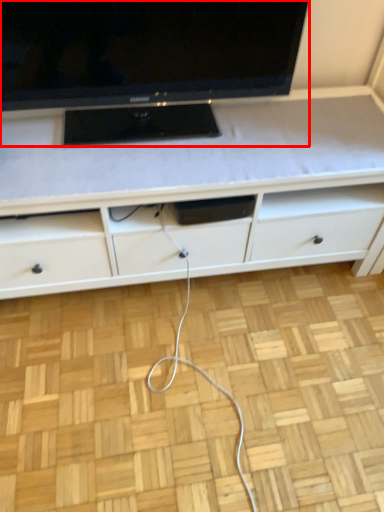
Question: Considering the relative positions of television (annotated by the red box) and cabinetry in the image provided, where is television (annotated by the red box) located with respect to the staircase?

Choices:
 (A) right
 (B) left

Answer: (B)